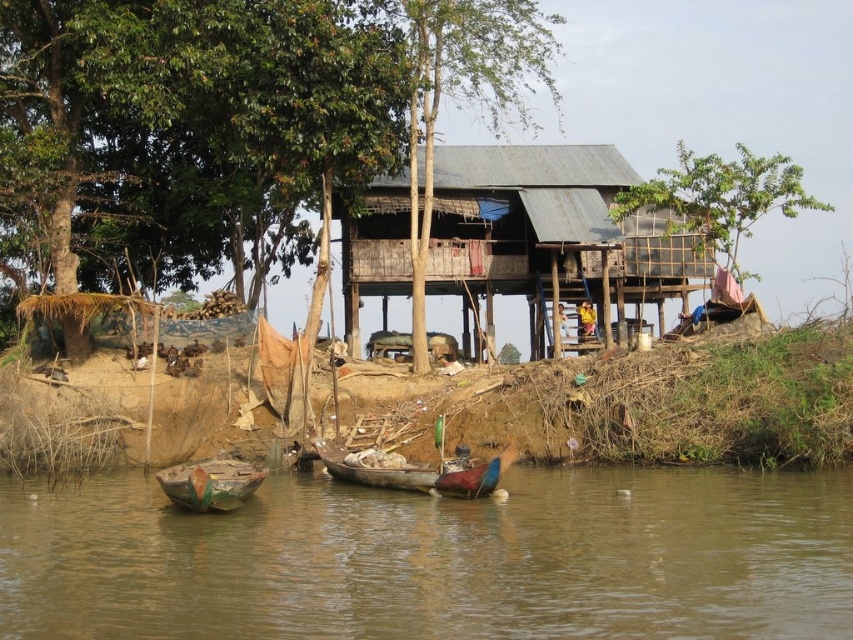
Question: Is rusty corrugated metal hut at center positioned behind yellow fabric person at center?

Choices:
 (A) yes
 (B) no

Answer: (B)

Question: Can you confirm if wooden boat at center is positioned below wooden boat at lower left?

Choices:
 (A) yes
 (B) no

Answer: (B)

Question: Based on their relative distances, which object is farther from the wooden boat at lower left?

Choices:
 (A) rusty corrugated metal hut at center
 (B) wooden boat at center
 (C) yellow fabric person at center

Answer: (C)

Question: Which of the following is the farthest from the observer?

Choices:
 (A) yellow fabric person at center
 (B) wooden boat at lower left

Answer: (A)

Question: Is the position of brown wooden boats at lower center more distant than that of yellow fabric person at center?

Choices:
 (A) no
 (B) yes

Answer: (A)

Question: Considering the real-world distances, which object is closest to the brown wooden boats at lower center?

Choices:
 (A) yellow fabric person at center
 (B) wooden boat at center
 (C) rusty corrugated metal hut at center
 (D) wooden boat at lower left

Answer: (B)